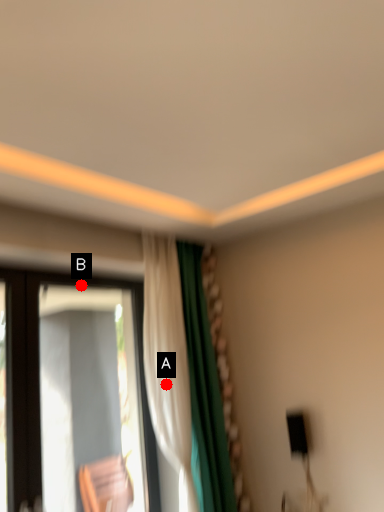
Question: Two points are circled on the image, labeled by A and B beside each circle. Which point is closer to the camera taking this photo?

Choices:
 (A) A is closer
 (B) B is closer

Answer: (B)